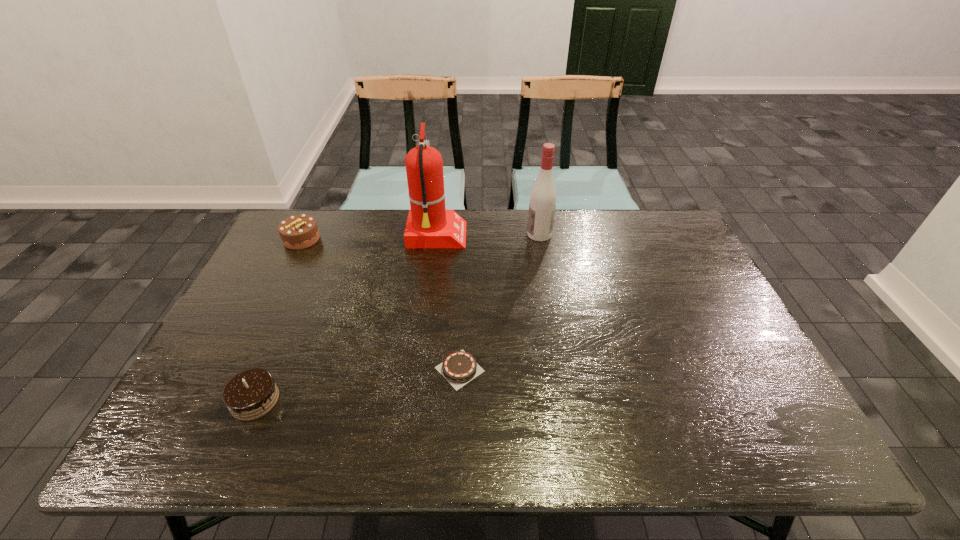
This screenshot has width=960, height=540. What are the coordinates of `fire extinguisher` in the screenshot? It's located at (429, 225).

I want to click on the rightmost object, so click(543, 196).

The image size is (960, 540). I want to click on the farthest chocolate cake, so click(x=297, y=232).

The height and width of the screenshot is (540, 960). What are the coordinates of `the shortest chocolate cake` in the screenshot? It's located at (458, 368).

Find the location of a particular element. The image size is (960, 540). the shortest object is located at coordinates (458, 368).

Find the location of a particular element. vacant space located 0.290m on the front-facing side of the fire extinguisher is located at coordinates (553, 237).

Locate an element on the screen. vacant area located 0.370m on the label of the rightmost object is located at coordinates (417, 234).

Find the location of a particular element. This screenshot has width=960, height=540. blank area located 0.100m on the label of the rightmost object is located at coordinates (497, 234).

Identify the location of free space located on the label of the rightmost object. This screenshot has width=960, height=540. (455, 234).

Where is `free space located 0.180m on the right of the farthest chocolate cake`? The image size is (960, 540). free space located 0.180m on the right of the farthest chocolate cake is located at coordinates (374, 239).